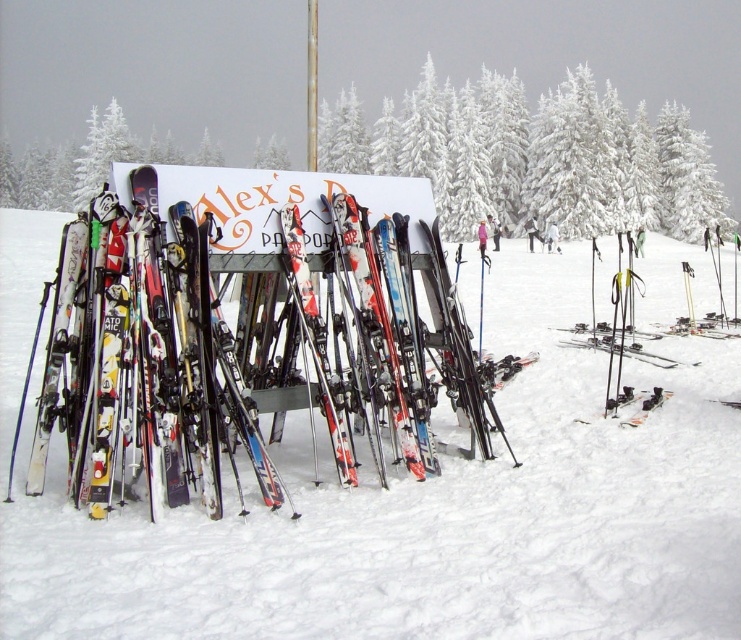
Is white snow-covered tree at center smaller than matte black ski at lower right?

Actually, white snow-covered tree at center might be larger than matte black ski at lower right.

Between point (562, 125) and point (654, 397), which one is positioned behind?

Positioned behind is point (562, 125).

Locate an element on the screen. The height and width of the screenshot is (640, 741). white snow-covered tree at center is located at coordinates (534, 156).

Who is positioned more to the left, multicolored plastic skis at center or matte black ski at lower right?

multicolored plastic skis at center

Where is `multicolored plastic skis at center`? The height and width of the screenshot is (640, 741). multicolored plastic skis at center is located at coordinates (245, 330).

In the scene shown: Which is above, multicolored plastic skis at center or white snow-covered tree at center?

white snow-covered tree at center is above.

Find the location of a particular element. multicolored plastic skis at center is located at coordinates (245, 330).